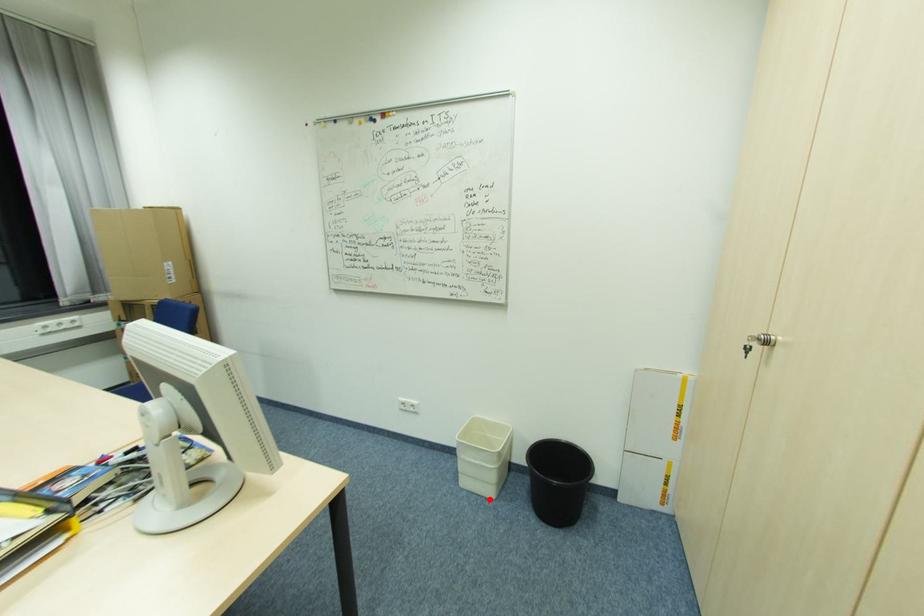
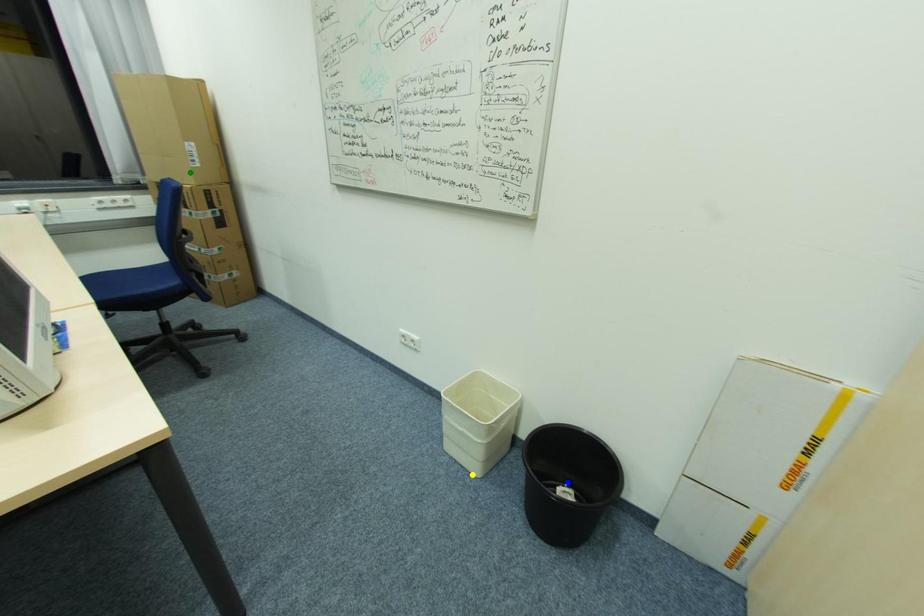
Question: I am providing you with two images of the same scene from different viewpoints. A red point is marked on the first image. You are given multiple points on the second image. Which spot in image 2 lines up with the point in image 1?

Choices:
 (A) blue point
 (B) green point
 (C) yellow point

Answer: (C)